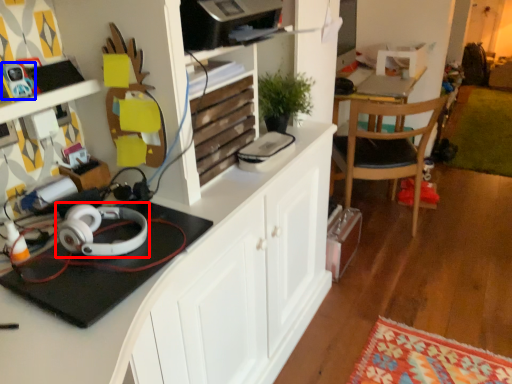
Question: Which point is closer to the camera, headphones (highlighted by a red box) or toy (highlighted by a blue box)?

Choices:
 (A) headphones
 (B) toy

Answer: (A)